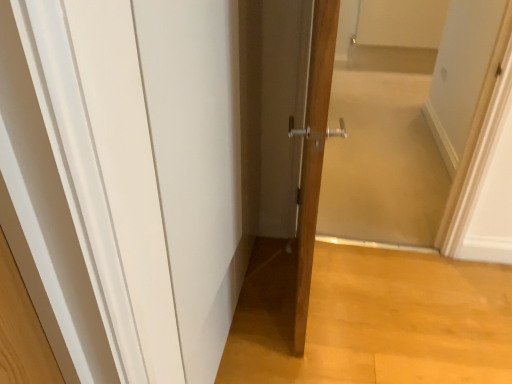
From the picture: Measure the distance between wooden door at center and camera.

wooden door at center is 39.27 inches away from camera.

What do you see at coordinates (313, 155) in the screenshot? The width and height of the screenshot is (512, 384). I see `wooden door at center` at bounding box center [313, 155].

Identify the location of wooden door at center. The width and height of the screenshot is (512, 384). (313, 155).

The width and height of the screenshot is (512, 384). What do you see at coordinates (420, 135) in the screenshot? I see `transparent glass door at center` at bounding box center [420, 135].

In order to face transparent glass door at center, should I rotate leftwards or rightwards?

It's best to rotate right around 18.749 degrees.

This screenshot has height=384, width=512. What are the coordinates of `transparent glass door at center` in the screenshot? It's located at (420, 135).

This screenshot has height=384, width=512. I want to click on wooden door at center, so click(313, 155).

Considering the positions of objects wooden door at center and transparent glass door at center in the image provided, who is more to the left, wooden door at center or transparent glass door at center?

Positioned to the left is wooden door at center.

Who is more distant, wooden door at center or transparent glass door at center?

Positioned behind is transparent glass door at center.

Does point (313, 224) come in front of point (400, 233)?

Yes, it is.

From the image's perspective, is wooden door at center located above or below transparent glass door at center?

From the image's perspective, wooden door at center appears below transparent glass door at center.

From the picture: From a real-world perspective, does wooden door at center stand above transparent glass door at center?

Yes, from a real-world perspective, wooden door at center is above transparent glass door at center.

Looking at this image, is wooden door at center wider or thinner than transparent glass door at center?

Clearly, wooden door at center has less width compared to transparent glass door at center.

Considering the sizes of wooden door at center and transparent glass door at center in the image, is wooden door at center taller or shorter than transparent glass door at center?

In the image, wooden door at center appears to be taller than transparent glass door at center.

Consider the image. Is wooden door at center bigger or smaller than transparent glass door at center?

In the image, wooden door at center appears to be smaller than transparent glass door at center.

Choose the correct answer: Is wooden door at center inside transparent glass door at center or outside it?

wooden door at center is spatially situated outside transparent glass door at center.

Is wooden door at center not close to transparent glass door at center?

That's right, there is a large distance between wooden door at center and transparent glass door at center.

Is wooden door at center turned away from transparent glass door at center?

wooden door at center is not turned away from transparent glass door at center.

The height and width of the screenshot is (384, 512). Identify the location of screen door directly beneath the wooden door at center (from a real-world perspective). click(x=420, y=135).

Considering the positions of objects transparent glass door at center and wooden door at center in the image provided, who is more to the right, transparent glass door at center or wooden door at center?

From the viewer's perspective, transparent glass door at center appears more on the right side.

Is the depth of transparent glass door at center greater than that of wooden door at center?

Yes, transparent glass door at center is further from the camera.

Considering the positions of point (509, 166) and point (294, 314), is point (509, 166) closer or farther from the camera than point (294, 314)?

Point (509, 166) is positioned farther from the camera compared to point (294, 314).

From the image's perspective, which is below, transparent glass door at center or wooden door at center?

wooden door at center.

From a real-world perspective, is transparent glass door at center on top of wooden door at center?

No, from a real-world perspective, transparent glass door at center is not above wooden door at center.

Considering the sizes of objects transparent glass door at center and wooden door at center in the image provided, who is thinner, transparent glass door at center or wooden door at center?

Thinner between the two is wooden door at center.

Who is taller, transparent glass door at center or wooden door at center?

With more height is wooden door at center.

Considering the sizes of objects transparent glass door at center and wooden door at center in the image provided, who is smaller, transparent glass door at center or wooden door at center?

Smaller between the two is wooden door at center.

Is transparent glass door at center completely or partially outside of wooden door at center?

Indeed, transparent glass door at center is completely outside wooden door at center.

From the picture: Are transparent glass door at center and wooden door at center making contact?

No, transparent glass door at center is not next to wooden door at center.

Is transparent glass door at center aimed at wooden door at center?

Yes, transparent glass door at center is aimed at wooden door at center.

How different are the orientations of transparent glass door at center and wooden door at center in degrees?

They differ by 83.7 degrees in their facing directions.

The height and width of the screenshot is (384, 512). Identify the location of door in front of the transparent glass door at center. (313, 155).

This screenshot has width=512, height=384. I want to click on door in front of the transparent glass door at center, so click(x=313, y=155).

At what (x,y) coordinates should I click in order to perform the action: click on door that is below the transparent glass door at center (from the image's perspective). Please return your answer as a coordinate pair (x, y). This screenshot has height=384, width=512. Looking at the image, I should click on (313, 155).